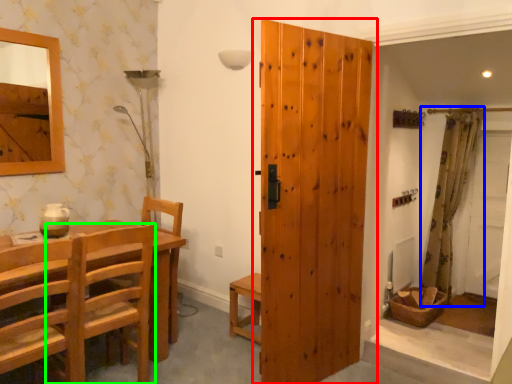
Question: Which object is positioned closest to door (highlighted by a red box)? Select from curtain (highlighted by a blue box) and chair (highlighted by a green box).

Choices:
 (A) curtain
 (B) chair

Answer: (B)